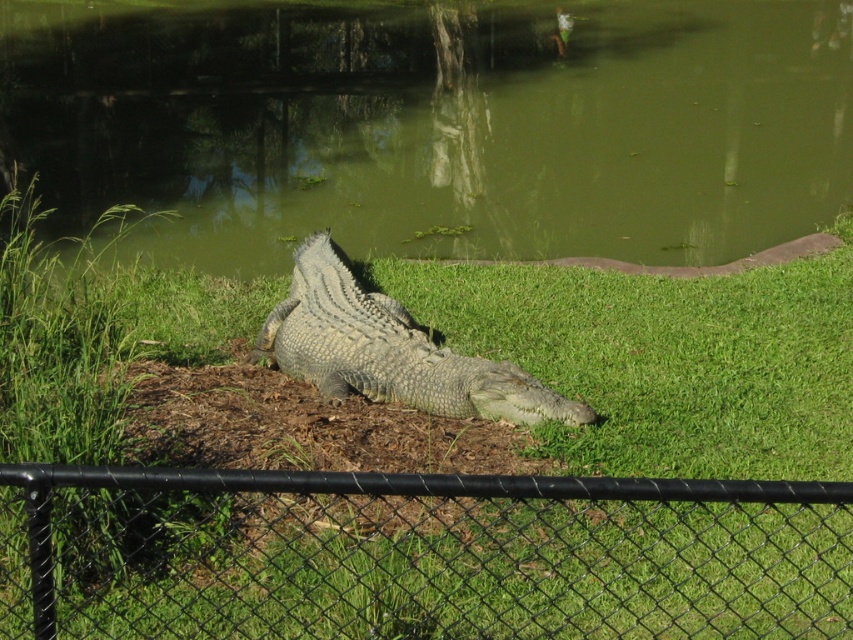
You are a wildlife photographer aiming to capture the gray scaly crocodile at center without getting too close. Since the green grassy at center is between you and the crocodile, how does the size of the grassy area compare to the crocodile?

The green grassy at center is smaller than the gray scaly crocodile at center, so the grassy area is not large enough to block the entire crocodile from view.